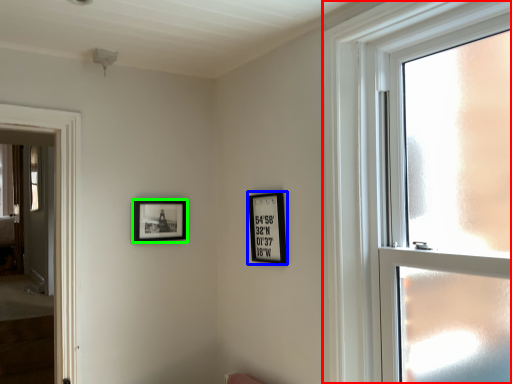
Question: Which object is the closest to the window (highlighted by a red box)? Choose among these: picture frame (highlighted by a blue box) or picture frame (highlighted by a green box).

Choices:
 (A) picture frame
 (B) picture frame

Answer: (A)